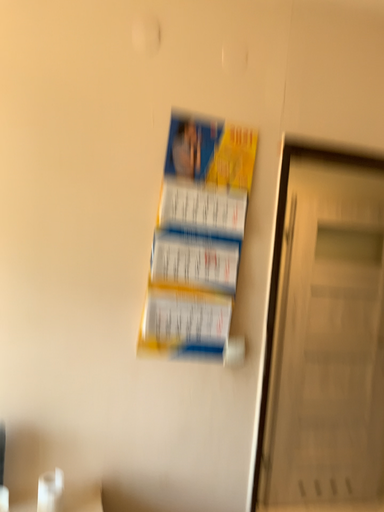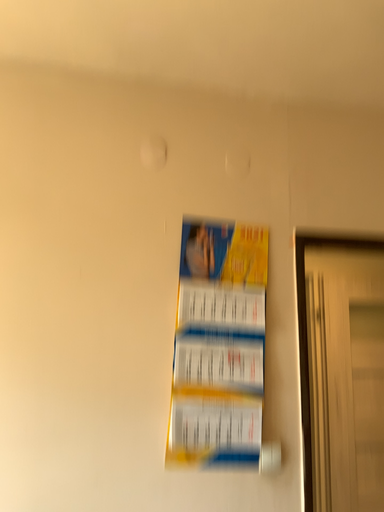
Question: How did the camera likely rotate when shooting the video?

Choices:
 (A) rotated downward
 (B) rotated upward

Answer: (B)